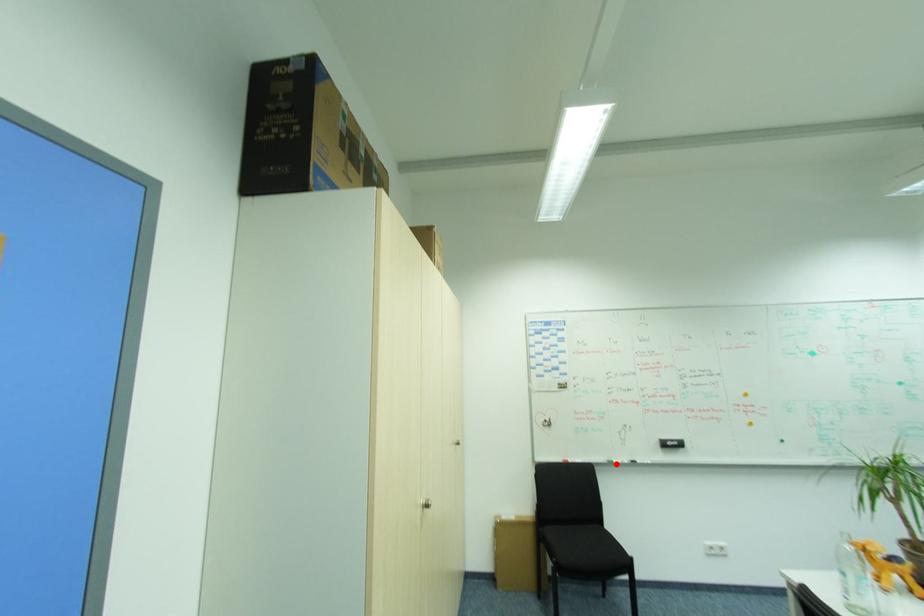
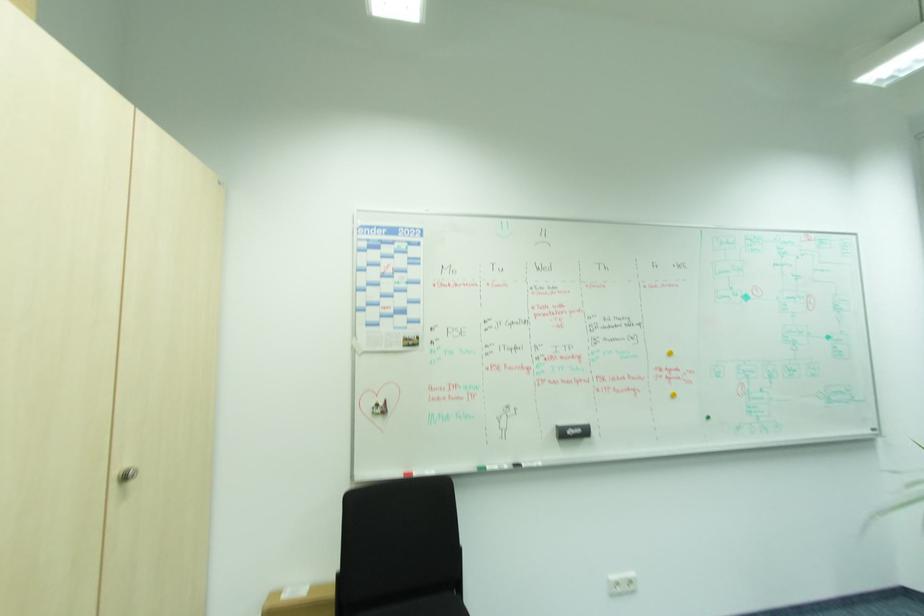
In the second image, find the point that corresponds to the highlighted location in the first image.

(487, 471)